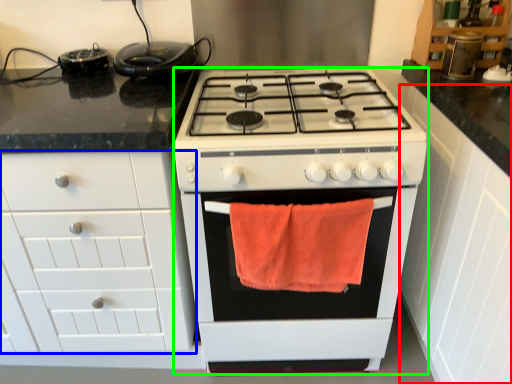
Question: Which object is the closest to the cabinetry (highlighted by a red box)? Choose among these: cabinetry (highlighted by a blue box) or appliance (highlighted by a green box).

Choices:
 (A) cabinetry
 (B) appliance

Answer: (B)